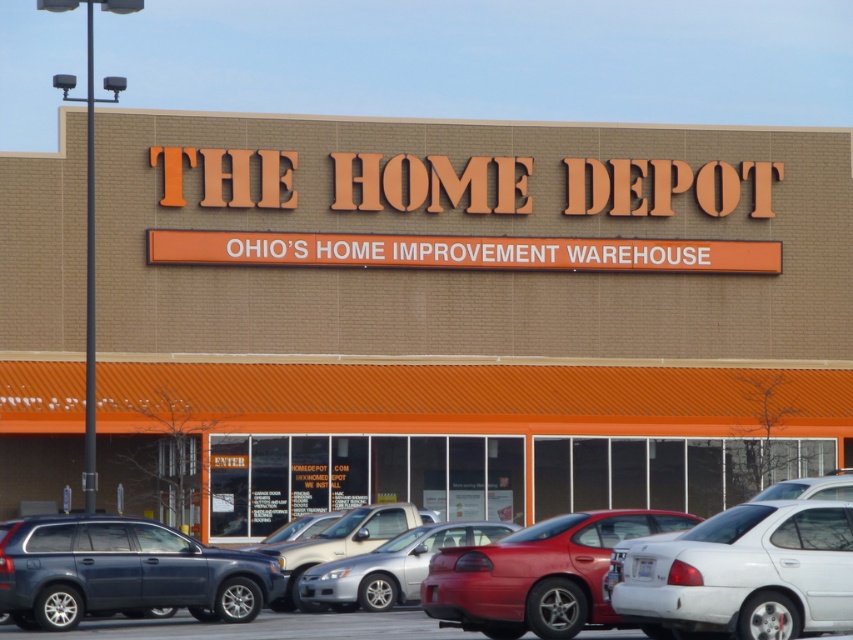
Question: Does brown brick building at center appear on the left side of silver metallic truck at center?

Choices:
 (A) yes
 (B) no

Answer: (B)

Question: Is brown brick building at center bigger than white glossy sedan at lower right?

Choices:
 (A) no
 (B) yes

Answer: (B)

Question: Which of the following is the closest to the observer?

Choices:
 (A) (567, 531)
 (B) (3, 182)

Answer: (A)

Question: Considering the relative positions of matte black suv at center and matte black sedan at center in the image provided, where is matte black suv at center located with respect to matte black sedan at center?

Choices:
 (A) right
 (B) left

Answer: (B)

Question: Estimate the real-world distances between objects in this image. Which object is closer to the matte black sedan at center?

Choices:
 (A) silver metallic truck at center
 (B) shiny red car at center
 (C) matte black suv at center
 (D) white glossy sedan at lower right

Answer: (C)

Question: Which of the following is the closest to the observer?

Choices:
 (A) white glossy sedan at lower right
 (B) matte black sedan at center

Answer: (A)